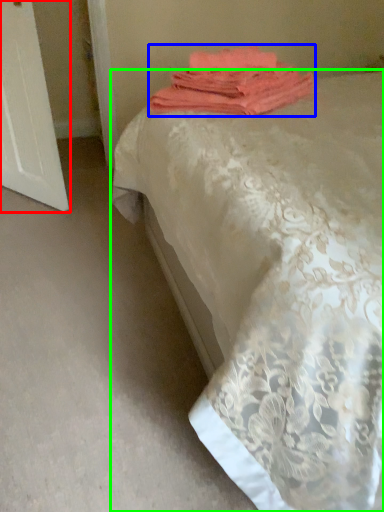
Question: Considering the real-world distances, which object is farthest from screen door (highlighted by a red box)? towel (highlighted by a blue box) or bed (highlighted by a green box)?

Choices:
 (A) towel
 (B) bed

Answer: (B)